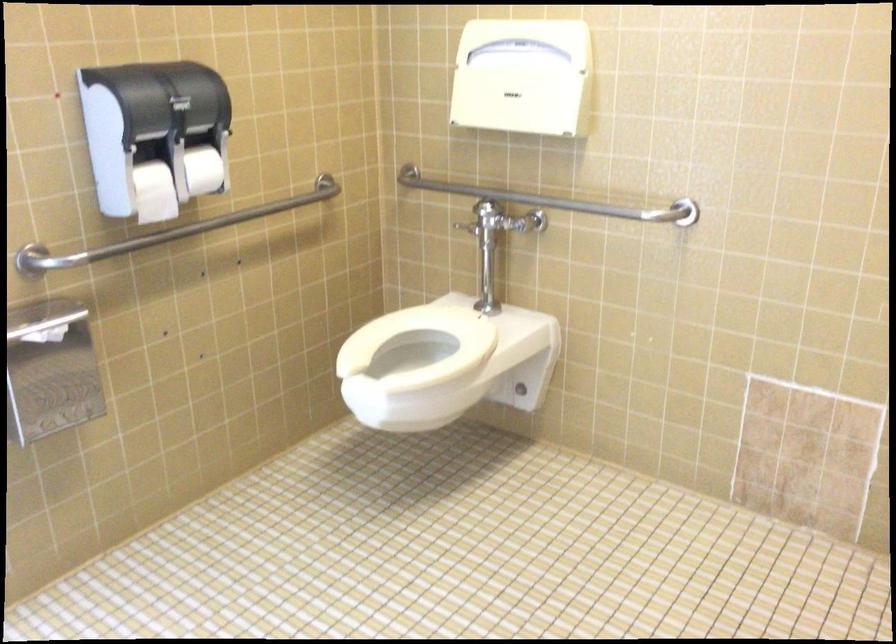
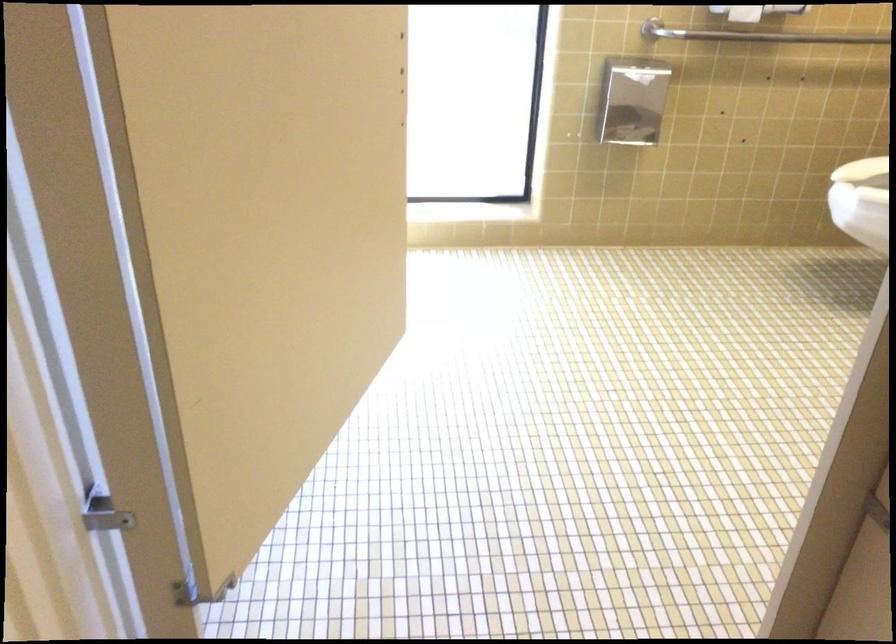
Question: The images are taken continuously from a first-person perspective. In which direction is your viewpoint rotating?

Choices:
 (A) Left
 (B) Right
 (C) Up
 (D) Down

Answer: (A)